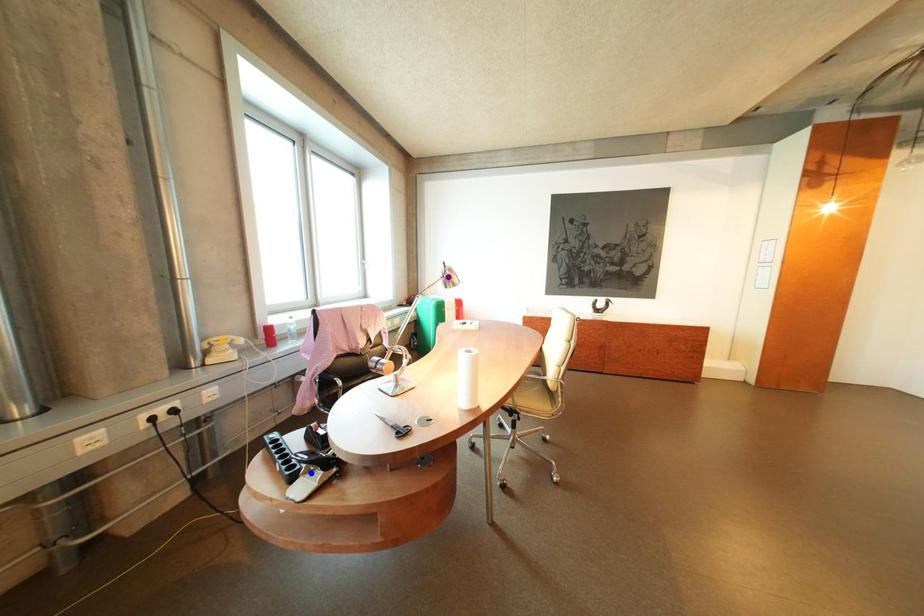
Order these from nearest to farthest:
blue point | purple point | orange point

blue point, purple point, orange point